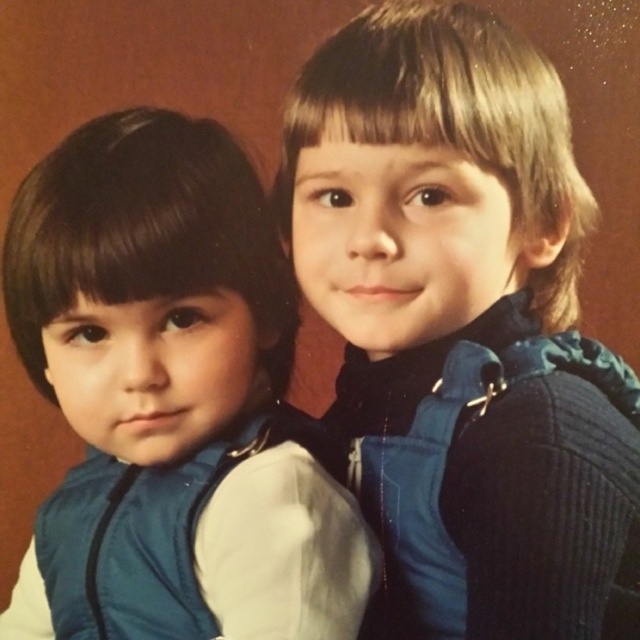
This screenshot has width=640, height=640. Describe the element at coordinates (464, 326) in the screenshot. I see `blue fabric vest at center` at that location.

Can you confirm if blue fabric vest at center is thinner than matte blue vest at left?

Yes.

Does point (529, 488) lie in front of point (269, 628)?

Yes.

I want to click on blue fabric vest at center, so click(464, 326).

Which of these two, matte blue vest at left or blue fleece vest at right, stands shorter?

Standing shorter between the two is blue fleece vest at right.

Does point (157, 172) lie in front of point (563, 586)?

No, (157, 172) is further to viewer.

Where is `matte blue vest at left`? matte blue vest at left is located at coordinates pos(170,400).

Who is lower down, blue fabric vest at center or teal fabric vest at left?

teal fabric vest at left

Locate an element on the screen. blue fabric vest at center is located at coordinates (464, 326).